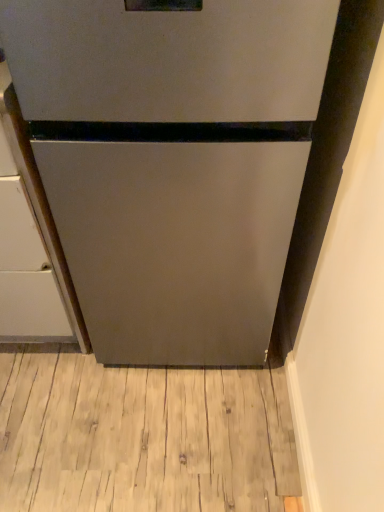
Question: From a real-world perspective, is satin silver refrigerator at center on satin silver cabinet at left?

Choices:
 (A) no
 (B) yes

Answer: (B)

Question: Is satin silver refrigerator at center behind satin silver cabinet at left?

Choices:
 (A) no
 (B) yes

Answer: (A)

Question: Is satin silver refrigerator at center completely or partially outside of satin silver cabinet at left?

Choices:
 (A) no
 (B) yes

Answer: (B)

Question: Is satin silver refrigerator at center at the right side of satin silver cabinet at left?

Choices:
 (A) no
 (B) yes

Answer: (B)

Question: Is satin silver refrigerator at center positioned in front of satin silver cabinet at left?

Choices:
 (A) yes
 (B) no

Answer: (A)

Question: Considering the relative sizes of satin silver refrigerator at center and satin silver cabinet at left in the image provided, is satin silver refrigerator at center wider than satin silver cabinet at left?

Choices:
 (A) no
 (B) yes

Answer: (A)

Question: Is light brown wood flooring at lower center at the right side of satin silver cabinet at left?

Choices:
 (A) yes
 (B) no

Answer: (A)

Question: Is light brown wood flooring at lower center taller than satin silver cabinet at left?

Choices:
 (A) no
 (B) yes

Answer: (A)

Question: Can you confirm if light brown wood flooring at lower center is smaller than satin silver cabinet at left?

Choices:
 (A) no
 (B) yes

Answer: (B)

Question: Is light brown wood flooring at lower center closer to the viewer compared to satin silver cabinet at left?

Choices:
 (A) no
 (B) yes

Answer: (A)

Question: Can you confirm if light brown wood flooring at lower center is thinner than satin silver cabinet at left?

Choices:
 (A) no
 (B) yes

Answer: (B)

Question: From the image's perspective, is light brown wood flooring at lower center above satin silver cabinet at left?

Choices:
 (A) yes
 (B) no

Answer: (B)

Question: Is light brown wood flooring at lower center at the back of satin silver refrigerator at center?

Choices:
 (A) yes
 (B) no

Answer: (B)